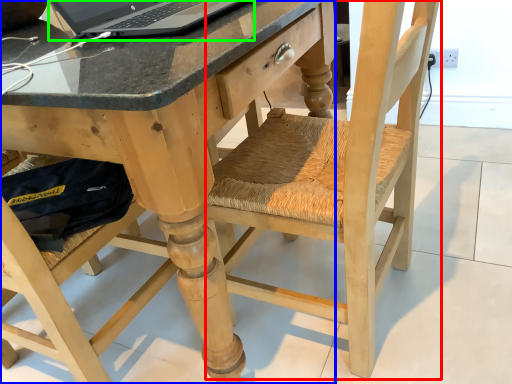
Question: Estimate the real-world distances between objects in this image. Which object is farther from swivel chair (highlighted by a red box), desk (highlighted by a blue box) or laptop (highlighted by a green box)?

Choices:
 (A) desk
 (B) laptop

Answer: (B)